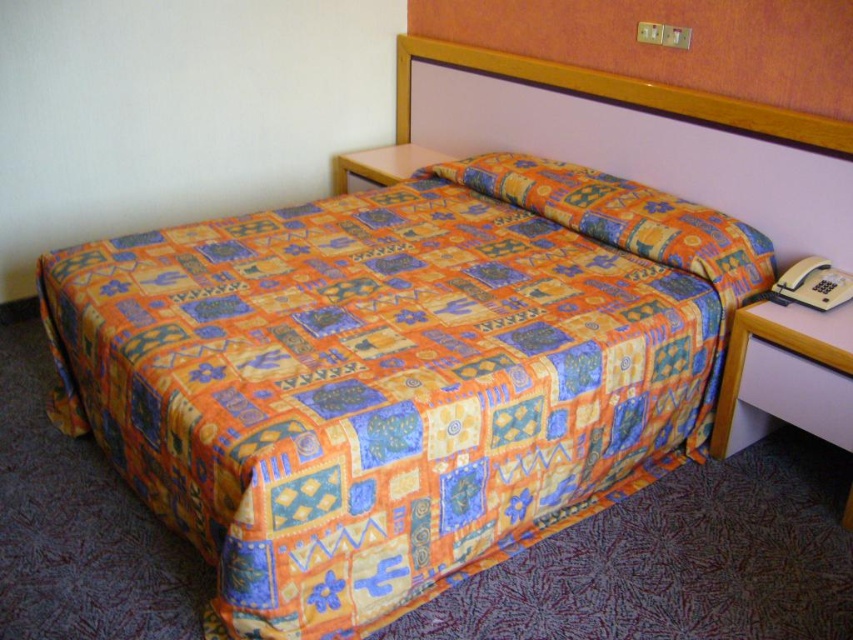
You are a guest in the hotel room and want to place a small book on the printed fabric quilt at center and the orange printed fabric pillow at center. Which surface can accommodate the book without it hanging off the edge?

The printed fabric quilt at center is taller than the orange printed fabric pillow at center, so the book will fit better on the printed fabric quilt at center.

Looking at this image, you are standing in a hotel room and want to place a 1.5 meter long ladder against the wall behind the printed fabric quilt at center. Can you fit the ladder there without it overlapping the quilt?

The printed fabric quilt at center is 1.43 meters away from the viewer. Since the ladder is 1.5 meters long, it might overlap the quilt depending on placement. Ensure there is enough space behind the quilt to accommodate the ladder without overlapping.